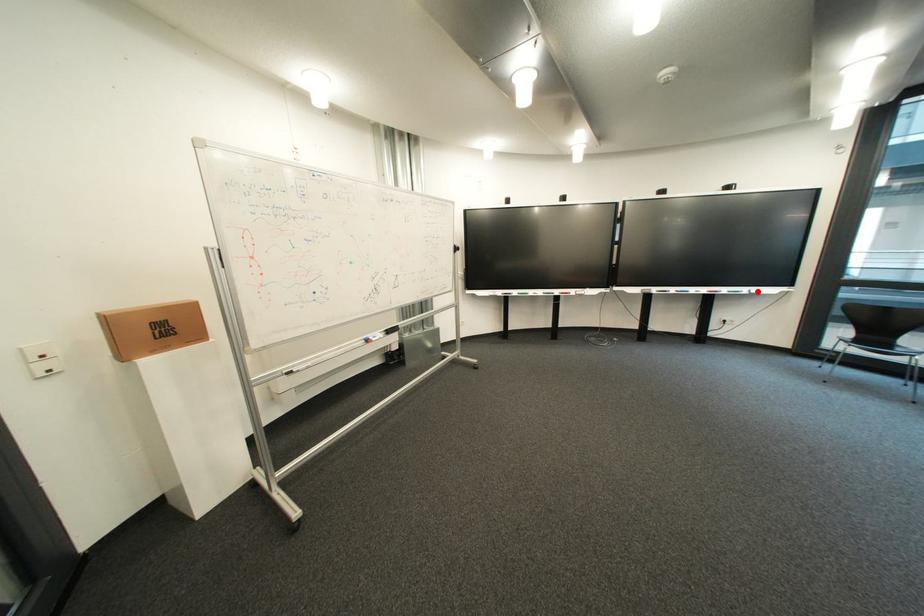
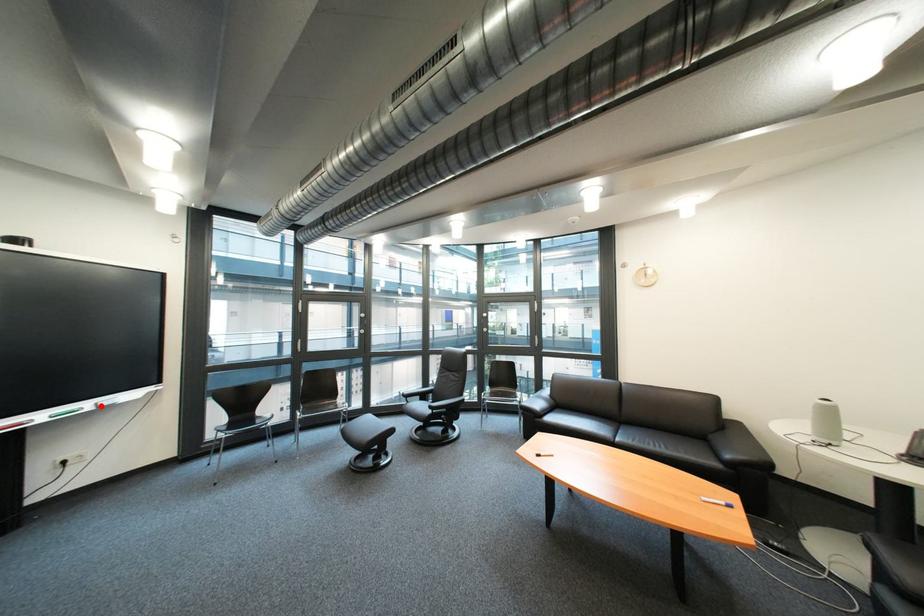
I am providing you with two images of the same scene from different viewpoints. A red point is marked on the first image and another point is marked on the second image. Is the red point in image1 aligned with the point shown in image2?

Yes